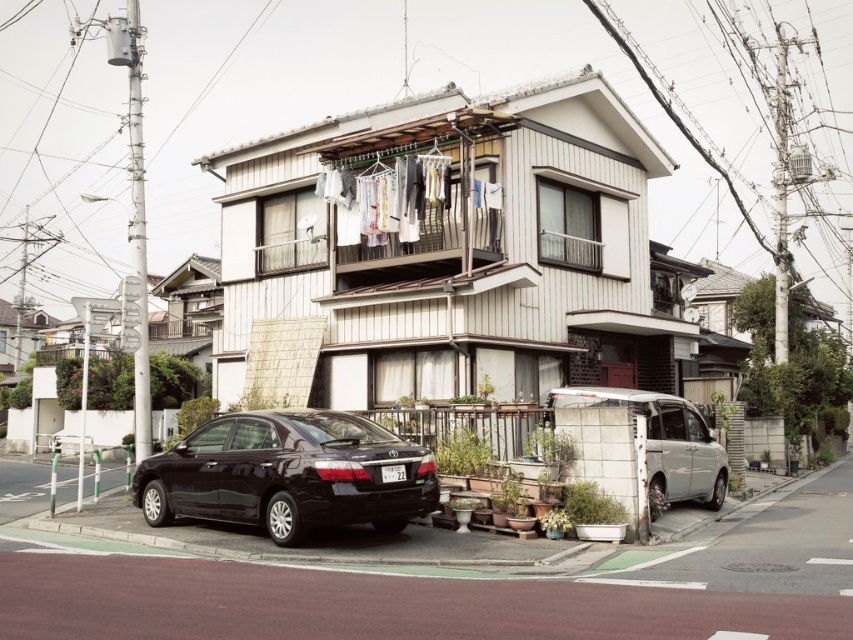
Can you confirm if black matte sedan at lower left is positioned above white fabric clothesline at upper center?

No.

Consider the image. Which of these two, black matte sedan at lower left or white fabric clothesline at upper center, stands taller?

With more height is white fabric clothesline at upper center.

Is point (389, 481) farther from camera compared to point (350, 172)?

That is False.

I want to click on black matte sedan at lower left, so click(289, 474).

Between black matte sedan at lower left and white matte van at lower right, which one has more height?

Standing taller between the two is white matte van at lower right.

Is black matte sedan at lower left shorter than white matte van at lower right?

Yes, black matte sedan at lower left is shorter than white matte van at lower right.

At what (x,y) coordinates should I click in order to perform the action: click on black matte sedan at lower left. Please return your answer as a coordinate pair (x, y). The height and width of the screenshot is (640, 853). Looking at the image, I should click on (289, 474).

Is white fabric clothesline at upper center to the right of white matte van at lower right from the viewer's perspective?

In fact, white fabric clothesline at upper center is to the left of white matte van at lower right.

Is the position of white fabric clothesline at upper center more distant than that of white matte van at lower right?

Yes, it is.

This screenshot has height=640, width=853. Find the location of `white fabric clothesline at upper center`. white fabric clothesline at upper center is located at coordinates (402, 198).